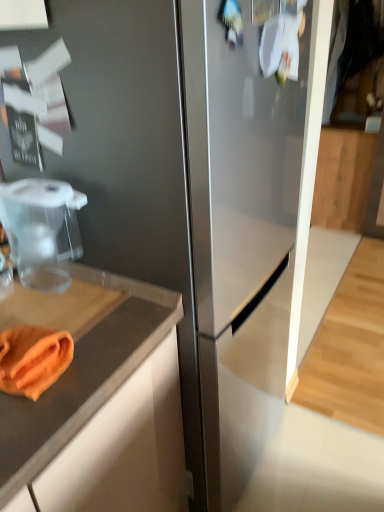
Where is `wooden cabinet at right`? This screenshot has height=512, width=384. wooden cabinet at right is located at coordinates (343, 178).

At what (x,y) coordinates should I click in order to perform the action: click on orange cloth at lower left. Please return your answer as a coordinate pair (x, y). Looking at the image, I should click on (33, 359).

This screenshot has height=512, width=384. Identify the location of wooden cabinet at right. (343, 178).

Could you tell me if orange cloth at lower left is facing transparent plastic food processor at left?

No, orange cloth at lower left does not turn towards transparent plastic food processor at left.

Is orange cloth at lower left not close to transparent plastic food processor at left?

orange cloth at lower left is near transparent plastic food processor at left, not far away.

Is orange cloth at lower left inside or outside of transparent plastic food processor at left?

orange cloth at lower left exists outside the volume of transparent plastic food processor at left.

From their relative heights in the image, would you say orange cloth at lower left is taller or shorter than transparent plastic food processor at left?

A: Considering their sizes, orange cloth at lower left has less height than transparent plastic food processor at left.

Which object is closer to the camera taking this photo, transparent plastic food processor at left or wooden cabinet at right?

transparent plastic food processor at left is closer to the camera.

From the image's perspective, does transparent plastic food processor at left appear higher than wooden cabinet at right?

No, from the image's perspective, transparent plastic food processor at left is not on top of wooden cabinet at right.

From a real-world perspective, is transparent plastic food processor at left under wooden cabinet at right?

No.

From the picture: Which object is wider, orange cloth at lower left or wooden cabinet at right?

With larger width is wooden cabinet at right.

Consider the image. Considering the positions of objects orange cloth at lower left and wooden cabinet at right in the image provided, who is in front, orange cloth at lower left or wooden cabinet at right?

orange cloth at lower left is in front.

From the image's perspective, which is below, orange cloth at lower left or wooden cabinet at right?

orange cloth at lower left.

Between orange cloth at lower left and wooden cabinet at right, which one has less height?

With less height is orange cloth at lower left.

Is wooden cabinet at right to the left of orange cloth at lower left from the viewer's perspective?

No.

Are wooden cabinet at right and orange cloth at lower left making contact?

wooden cabinet at right and orange cloth at lower left are clearly separated.

Does point (332, 215) lie behind point (41, 356)?

Yes.

From a real-world perspective, is wooden cabinet at right positioned above or below orange cloth at lower left?

In terms of real-world spatial position, wooden cabinet at right is below orange cloth at lower left.

Is transparent plastic food processor at left beside orange cloth at lower left?

No, transparent plastic food processor at left is not touching orange cloth at lower left.

From a real-world perspective, is transparent plastic food processor at left beneath orange cloth at lower left?

No, from a real-world perspective, transparent plastic food processor at left is not under orange cloth at lower left.

Locate an element on the screen. food below the transparent plastic food processor at left (from a real-world perspective) is located at coordinates (33, 359).

From the image's perspective, which object appears higher, wooden cabinet at right or transparent plastic food processor at left?

wooden cabinet at right.

This screenshot has height=512, width=384. Find the location of `cabinetry behind the transparent plastic food processor at left`. cabinetry behind the transparent plastic food processor at left is located at coordinates (343, 178).

Is wooden cabinet at right surrounding transparent plastic food processor at left?

No, transparent plastic food processor at left is located outside of wooden cabinet at right.

Considering the sizes of objects wooden cabinet at right and transparent plastic food processor at left in the image provided, who is smaller, wooden cabinet at right or transparent plastic food processor at left?

transparent plastic food processor at left is smaller.

What are the coordinates of `food below the transparent plastic food processor at left (from a real-world perspective)` in the screenshot? It's located at (33, 359).

Image resolution: width=384 pixels, height=512 pixels. Identify the location of cabinetry that appears above the transparent plastic food processor at left (from the image's perspective). (343, 178).

Estimate the real-world distances between objects in this image. Which object is further from orange cloth at lower left, transparent plastic food processor at left or wooden cabinet at right?

wooden cabinet at right lies further to orange cloth at lower left than the other object.

From the image, which object appears to be nearer to transparent plastic food processor at left, wooden cabinet at right or orange cloth at lower left?

Among the two, orange cloth at lower left is located nearer to transparent plastic food processor at left.

Based on their spatial positions, is wooden cabinet at right or transparent plastic food processor at left closer to orange cloth at lower left?

transparent plastic food processor at left lies closer to orange cloth at lower left than the other object.

Considering their positions, is orange cloth at lower left positioned closer to transparent plastic food processor at left than wooden cabinet at right?

Based on the image, orange cloth at lower left appears to be nearer to transparent plastic food processor at left.

Looking at the image, which one is located closer to wooden cabinet at right, transparent plastic food processor at left or orange cloth at lower left?

The object closer to wooden cabinet at right is transparent plastic food processor at left.

From the image, which object appears to be nearer to wooden cabinet at right, orange cloth at lower left or transparent plastic food processor at left?

transparent plastic food processor at left.

I want to click on food processor located between orange cloth at lower left and wooden cabinet at right in the depth direction, so click(42, 230).